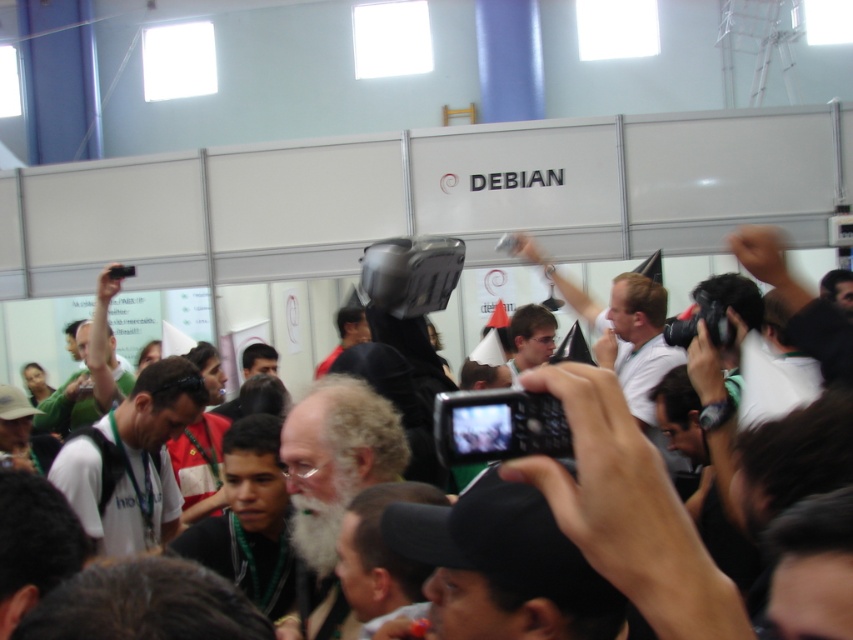
Is point (74, 380) positioned behind point (519, 324)?

Yes.

Identify the location of green fabric shirt at center. The width and height of the screenshot is (853, 640). pyautogui.click(x=68, y=406).

In the scene shown: Is white matte shirt at center to the right of green fabric shirt at center from the viewer's perspective?

Correct, you'll find white matte shirt at center to the right of green fabric shirt at center.

Which is behind, point (152, 481) or point (61, 416)?

The point (61, 416) is behind.

Who is more forward, (97, 474) or (56, 394)?

Positioned in front is point (97, 474).

Find the location of `white matte shirt at center`. white matte shirt at center is located at coordinates (132, 460).

Does point (160, 508) come in front of point (543, 310)?

Yes, it is.

From the picture: Can you confirm if white matte shirt at center is positioned to the right of matte black glasses at center?

In fact, white matte shirt at center is to the left of matte black glasses at center.

Is point (78, 468) behind point (552, 349)?

No, (78, 468) is closer to viewer.

I want to click on white matte shirt at center, so (132, 460).